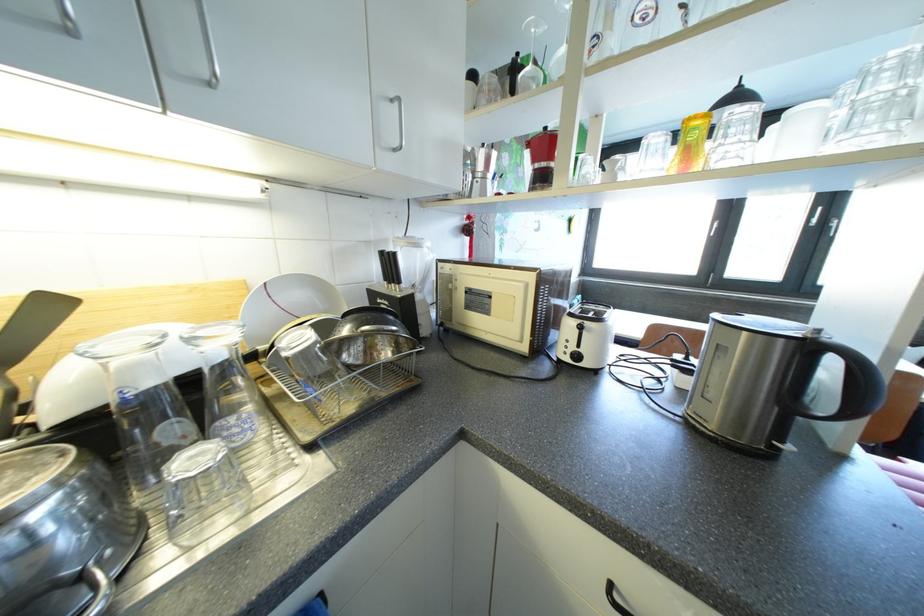
Where would you lift the black kettle handle? Please return your answer as a coordinate pair (x, y).

(854, 386)